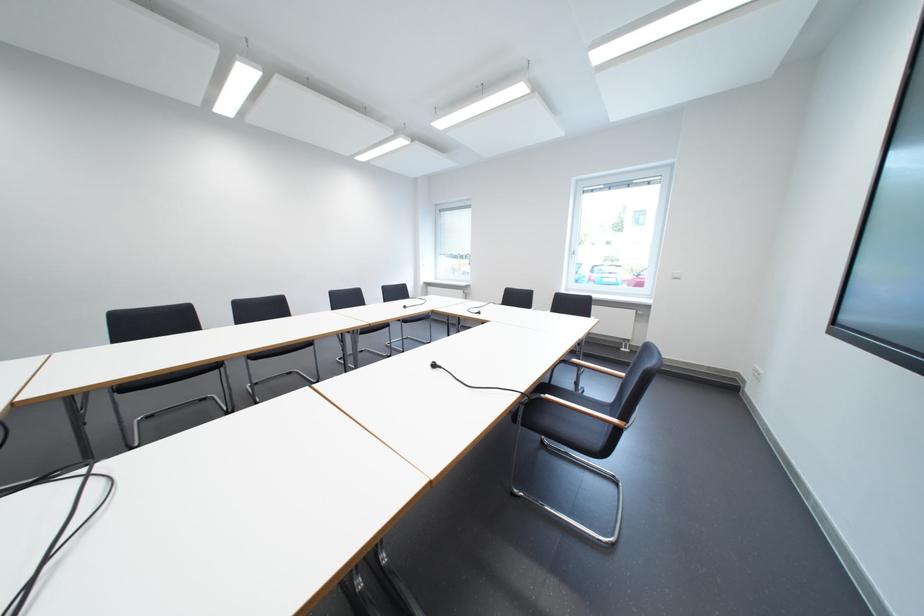
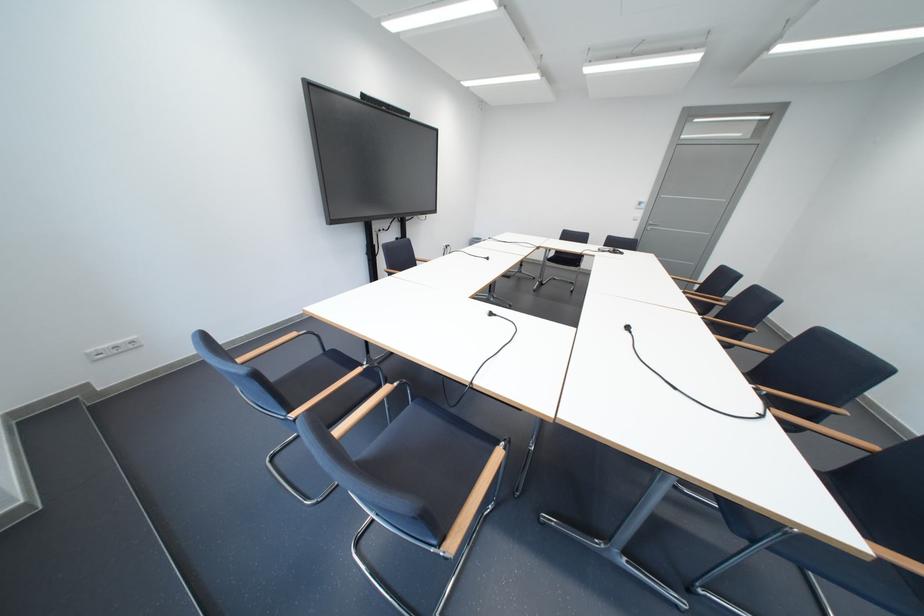
In the second image, find the point that corresponds to the point at 492,314 in the first image.

(503, 315)